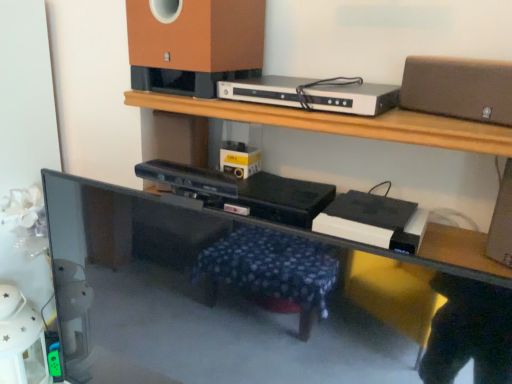
Locate an element on the screen. silver metallic dvd player at upper center is located at coordinates (313, 94).

Identify the location of black glossy computer desk at lower left. The width and height of the screenshot is (512, 384). (251, 300).

In order to click on matte brown speaker at upper right, placed as the second speaker when sorted from left to right in this screenshot , I will do `click(458, 88)`.

Relative to matte brown speaker at upper right, acting as the 1th speaker starting from the right, is silver metallic dvd player at upper center in front or behind?

In the image, silver metallic dvd player at upper center appears behind matte brown speaker at upper right, acting as the 1th speaker starting from the right.

Is silver metallic dvd player at upper center spatially inside matte brown speaker at upper right, placed as the second speaker when sorted from left to right, or outside of it?

silver metallic dvd player at upper center cannot be found inside matte brown speaker at upper right, placed as the second speaker when sorted from left to right.

Considering the sizes of silver metallic dvd player at upper center and matte brown speaker at upper right, placed as the second speaker when sorted from left to right, in the image, is silver metallic dvd player at upper center taller or shorter than matte brown speaker at upper right, placed as the second speaker when sorted from left to right,?

Clearly, silver metallic dvd player at upper center is shorter compared to matte brown speaker at upper right, placed as the second speaker when sorted from left to right.

Considering the relative positions of silver metallic dvd player at upper center and matte brown speaker at upper right, acting as the 1th speaker starting from the right, in the image provided, is silver metallic dvd player at upper center to the right of matte brown speaker at upper right, acting as the 1th speaker starting from the right, from the viewer's perspective?

In fact, silver metallic dvd player at upper center is to the left of matte brown speaker at upper right, acting as the 1th speaker starting from the right.

Consider the image. Is matte brown speaker at upper center, which appears as the 2th speaker when viewed from the right, aimed at black glossy computer desk at lower left?

No.

Is point (208, 69) closer or farther from the camera than point (240, 341)?

Point (208, 69) is positioned farther from the camera compared to point (240, 341).

Between matte brown speaker at upper center, which appears as the 2th speaker when viewed from the right, and black glossy computer desk at lower left, which one has less height?

matte brown speaker at upper center, which appears as the 2th speaker when viewed from the right.

Can you confirm if matte brown speaker at upper center, the first speaker in the left-to-right sequence, is bigger than black glossy computer desk at lower left?

No.

Is point (508, 66) positioned behind point (253, 96)?

No, it is in front of (253, 96).

Is matte brown speaker at upper right, placed as the second speaker when sorted from left to right, further to the viewer compared to silver metallic dvd player at upper center?

No, matte brown speaker at upper right, placed as the second speaker when sorted from left to right, is closer to the camera.

Does matte brown speaker at upper right, acting as the 1th speaker starting from the right, have a greater width compared to silver metallic dvd player at upper center?

No, matte brown speaker at upper right, acting as the 1th speaker starting from the right, is not wider than silver metallic dvd player at upper center.

Would you say matte brown speaker at upper right, placed as the second speaker when sorted from left to right, is to the left or to the right of silver metallic dvd player at upper center in the picture?

In the image, matte brown speaker at upper right, placed as the second speaker when sorted from left to right, appears on the right side of silver metallic dvd player at upper center.

Looking at this image, is matte brown speaker at upper center, which appears as the 2th speaker when viewed from the right, far away from silver metallic dvd player at upper center?

matte brown speaker at upper center, which appears as the 2th speaker when viewed from the right, is near silver metallic dvd player at upper center, not far away.

Image resolution: width=512 pixels, height=384 pixels. Find the location of `gadget located in front of the matte brown speaker at upper center, the first speaker in the left-to-right sequence`. gadget located in front of the matte brown speaker at upper center, the first speaker in the left-to-right sequence is located at coordinates (313, 94).

Which is behind, matte brown speaker at upper center, the first speaker in the left-to-right sequence, or silver metallic dvd player at upper center?

matte brown speaker at upper center, the first speaker in the left-to-right sequence.

Does black glossy computer desk at lower left have a smaller size compared to matte brown speaker at upper right, placed as the second speaker when sorted from left to right?

No.

Considering their positions, is black glossy computer desk at lower left located in front of or behind matte brown speaker at upper right, acting as the 1th speaker starting from the right?

Visually, black glossy computer desk at lower left is located in front of matte brown speaker at upper right, acting as the 1th speaker starting from the right.

This screenshot has height=384, width=512. What are the coordinates of `the 1st speaker positioned above the black glossy computer desk at lower left (from the image's perspective)` in the screenshot? It's located at (458, 88).

Considering the sizes of objects silver metallic dvd player at upper center and matte brown speaker at upper center, which appears as the 2th speaker when viewed from the right, in the image provided, who is shorter, silver metallic dvd player at upper center or matte brown speaker at upper center, which appears as the 2th speaker when viewed from the right,?

With less height is silver metallic dvd player at upper center.

Locate an element on the screen. gadget below the matte brown speaker at upper center, which appears as the 2th speaker when viewed from the right (from a real-world perspective) is located at coordinates [x=313, y=94].

From the image's perspective, which one is positioned lower, silver metallic dvd player at upper center or matte brown speaker at upper center, which appears as the 2th speaker when viewed from the right?

silver metallic dvd player at upper center.

Is silver metallic dvd player at upper center at the right side of matte brown speaker at upper center, which appears as the 2th speaker when viewed from the right?

Yes, silver metallic dvd player at upper center is to the right of matte brown speaker at upper center, which appears as the 2th speaker when viewed from the right.

From the image's perspective, which is above, matte brown speaker at upper right, placed as the second speaker when sorted from left to right, or black glossy computer desk at lower left?

matte brown speaker at upper right, placed as the second speaker when sorted from left to right, appears higher in the image.

From the image's perspective, count 1st speakers upward from the black glossy computer desk at lower left and point to it. Please provide its 2D coordinates.

[(458, 88)]

Are matte brown speaker at upper right, placed as the second speaker when sorted from left to right, and black glossy computer desk at lower left located far from each other?

They are positioned close to each other.

Locate an element on the screen. gadget directly beneath the matte brown speaker at upper right, placed as the second speaker when sorted from left to right (from a real-world perspective) is located at coordinates (313, 94).

From a real-world perspective, count 2nd speakers upward from the black glossy computer desk at lower left and point to it. Please provide its 2D coordinates.

[(198, 36)]

Estimate the real-world distances between objects in this image. Which object is further from black glossy computer desk at lower left, silver metallic dvd player at upper center or matte brown speaker at upper right, placed as the second speaker when sorted from left to right?

matte brown speaker at upper right, placed as the second speaker when sorted from left to right, is further to black glossy computer desk at lower left.

Considering their positions, is matte brown speaker at upper center, which appears as the 2th speaker when viewed from the right, positioned further to black glossy computer desk at lower left than matte brown speaker at upper right, placed as the second speaker when sorted from left to right?

matte brown speaker at upper right, placed as the second speaker when sorted from left to right, is positioned further to the anchor black glossy computer desk at lower left.

Looking at the image, which one is located further to matte brown speaker at upper center, which appears as the 2th speaker when viewed from the right, black glossy computer desk at lower left or matte brown speaker at upper right, placed as the second speaker when sorted from left to right?

Based on the image, black glossy computer desk at lower left appears to be further to matte brown speaker at upper center, which appears as the 2th speaker when viewed from the right.

From the image, which object appears to be farther from silver metallic dvd player at upper center, matte brown speaker at upper right, acting as the 1th speaker starting from the right, or matte brown speaker at upper center, which appears as the 2th speaker when viewed from the right?

Among the two, matte brown speaker at upper right, acting as the 1th speaker starting from the right, is located further to silver metallic dvd player at upper center.

When comparing their distances from matte brown speaker at upper right, acting as the 1th speaker starting from the right, does matte brown speaker at upper center, which appears as the 2th speaker when viewed from the right, or silver metallic dvd player at upper center seem further?

matte brown speaker at upper center, which appears as the 2th speaker when viewed from the right, is positioned further to the anchor matte brown speaker at upper right, acting as the 1th speaker starting from the right.

Based on their spatial positions, is matte brown speaker at upper center, the first speaker in the left-to-right sequence, or silver metallic dvd player at upper center further from black glossy computer desk at lower left?

Based on the image, matte brown speaker at upper center, the first speaker in the left-to-right sequence, appears to be further to black glossy computer desk at lower left.

From the image, which object appears to be nearer to matte brown speaker at upper right, placed as the second speaker when sorted from left to right, matte brown speaker at upper center, which appears as the 2th speaker when viewed from the right, or black glossy computer desk at lower left?

matte brown speaker at upper center, which appears as the 2th speaker when viewed from the right, is positioned closer to the anchor matte brown speaker at upper right, placed as the second speaker when sorted from left to right.

Based on the photo, based on their spatial positions, is silver metallic dvd player at upper center or black glossy computer desk at lower left further from matte brown speaker at upper center, which appears as the 2th speaker when viewed from the right?

Among the two, black glossy computer desk at lower left is located further to matte brown speaker at upper center, which appears as the 2th speaker when viewed from the right.

Identify the location of gadget between matte brown speaker at upper center, the first speaker in the left-to-right sequence, and matte brown speaker at upper right, placed as the second speaker when sorted from left to right. (x=313, y=94).

At what (x,y) coordinates should I click in order to perform the action: click on gadget between matte brown speaker at upper center, which appears as the 2th speaker when viewed from the right, and black glossy computer desk at lower left vertically. Please return your answer as a coordinate pair (x, y). The height and width of the screenshot is (384, 512). Looking at the image, I should click on (313, 94).

Where is `speaker between silver metallic dvd player at upper center and black glossy computer desk at lower left vertically`? speaker between silver metallic dvd player at upper center and black glossy computer desk at lower left vertically is located at coordinates (458, 88).

Locate an element on the screen. Image resolution: width=512 pixels, height=384 pixels. speaker between matte brown speaker at upper center, the first speaker in the left-to-right sequence, and black glossy computer desk at lower left from top to bottom is located at coordinates (458, 88).